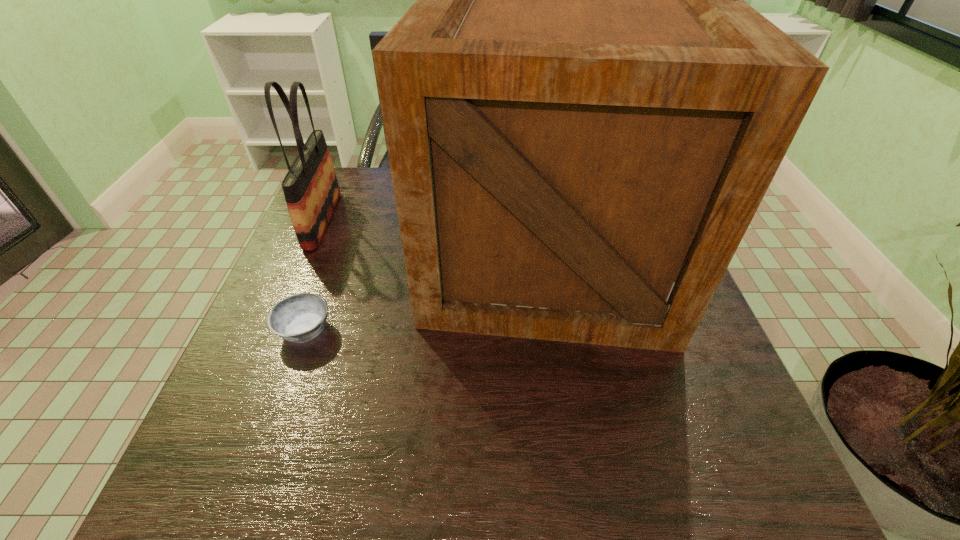
Find the location of `the rightmost object`. the rightmost object is located at coordinates (582, 115).

The width and height of the screenshot is (960, 540). In order to click on box in this screenshot , I will do `click(582, 115)`.

Where is `the second tallest object`? the second tallest object is located at coordinates [311, 190].

This screenshot has width=960, height=540. Identify the location of the shortest object. (299, 318).

Locate an element on the screen. This screenshot has width=960, height=540. free space located 0.150m on the front of the tallest object is located at coordinates (575, 423).

Where is `vacant space located 0.200m on the front-facing side of the shopping bag`? This screenshot has height=540, width=960. vacant space located 0.200m on the front-facing side of the shopping bag is located at coordinates (411, 220).

Locate an element on the screen. The width and height of the screenshot is (960, 540). free space located on the right of the ashtray is located at coordinates (435, 330).

What are the coordinates of `box present at the far edge` in the screenshot? It's located at (582, 115).

This screenshot has height=540, width=960. In order to click on shopping bag that is positioned at the far edge in this screenshot , I will do `click(311, 190)`.

Find the location of a particular element. This screenshot has height=540, width=960. shopping bag at the left edge is located at coordinates (311, 190).